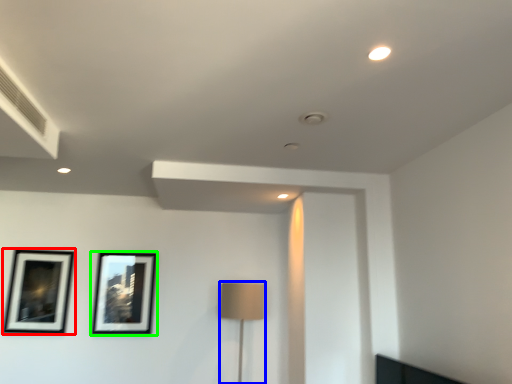
Question: Which is farther away from picture frame (highlighted by a red box)? table lamp (highlighted by a blue box) or picture frame (highlighted by a green box)?

Choices:
 (A) table lamp
 (B) picture frame

Answer: (A)